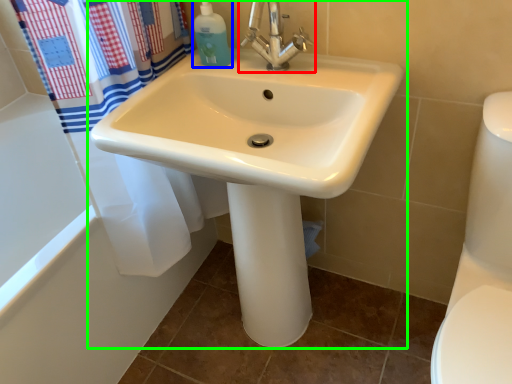
Question: Which object is the farthest from tap (highlighted by a red box)? Choose among these: cleaning product (highlighted by a blue box) or sink (highlighted by a green box).

Choices:
 (A) cleaning product
 (B) sink

Answer: (B)